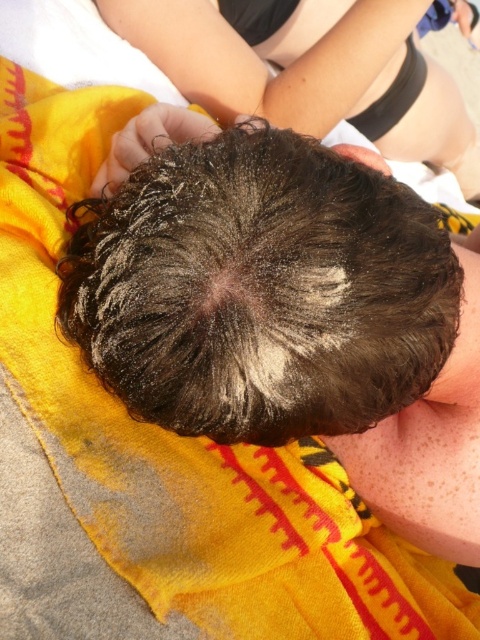
From the picture: You are a photographer trying to capture the best shot of the scene. You notice two points in the image labeled as point [400,282] and point [355,49]. Which point should you focus on to ensure the subject in front is sharp?

Point [400,282] should be focused on because it is in front of point [355,49], making it the closer subject to the camera.

You are a lifeguard at the beach and need to determine if the dark brown curly hair at center belongs to the same person as the dry skin at center. Based on the size comparison between the two, can you confirm if they are part of the same individual?

The dark brown curly hair at center is smaller than dry skin at center, so they are likely part of the same individual since hair is typically smaller than the skin area it grows on.